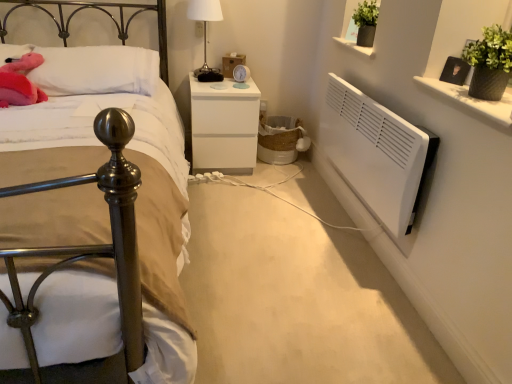
Question: Is white glossy vase at upper right positioned behind fluffy pink plush at upper left?

Choices:
 (A) yes
 (B) no

Answer: (B)

Question: From the image's perspective, is white glossy vase at upper right below fluffy pink plush at upper left?

Choices:
 (A) yes
 (B) no

Answer: (A)

Question: Is white glossy vase at upper right in contact with fluffy pink plush at upper left?

Choices:
 (A) no
 (B) yes

Answer: (A)

Question: Does white glossy vase at upper right have a lesser height compared to fluffy pink plush at upper left?

Choices:
 (A) yes
 (B) no

Answer: (A)

Question: Does white glossy vase at upper right come in front of fluffy pink plush at upper left?

Choices:
 (A) yes
 (B) no

Answer: (A)

Question: Would you say white glossy vase at upper right is outside fluffy pink plush at upper left?

Choices:
 (A) no
 (B) yes

Answer: (B)

Question: Is the surface of white glossy table lamp at upper center in direct contact with fluffy pink plush at upper left?

Choices:
 (A) yes
 (B) no

Answer: (B)

Question: From the image's perspective, would you say white glossy table lamp at upper center is shown under fluffy pink plush at upper left?

Choices:
 (A) no
 (B) yes

Answer: (A)

Question: Does white glossy table lamp at upper center have a larger size compared to fluffy pink plush at upper left?

Choices:
 (A) yes
 (B) no

Answer: (B)

Question: Is white glossy table lamp at upper center wider than fluffy pink plush at upper left?

Choices:
 (A) yes
 (B) no

Answer: (B)

Question: From a real-world perspective, is white glossy table lamp at upper center beneath fluffy pink plush at upper left?

Choices:
 (A) no
 (B) yes

Answer: (A)

Question: Are white glossy table lamp at upper center and fluffy pink plush at upper left far apart?

Choices:
 (A) no
 (B) yes

Answer: (A)

Question: Can you confirm if white soft pillow at upper left is wider than fluffy pink plush at upper left?

Choices:
 (A) no
 (B) yes

Answer: (A)